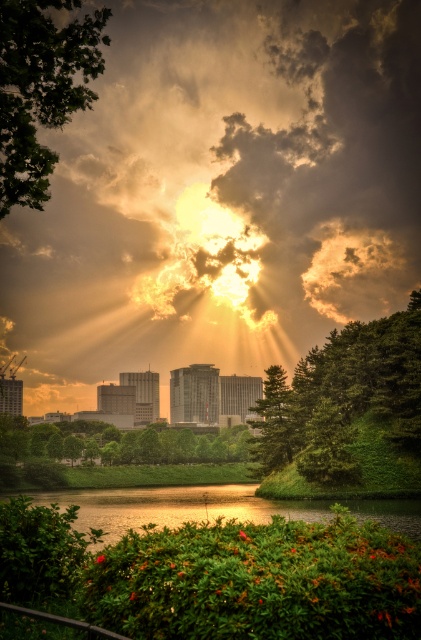
You are an artist trying to paint the sunset scene. You want to place the green textured tree at right and the green leafy tree at upper left in your painting. According to the scene, which tree should you draw first to ensure proper placement?

The green leafy tree at upper left should be drawn first because the green textured tree at right is positioned on its right side, meaning it is placed after the upper left tree to maintain the correct spatial arrangement.